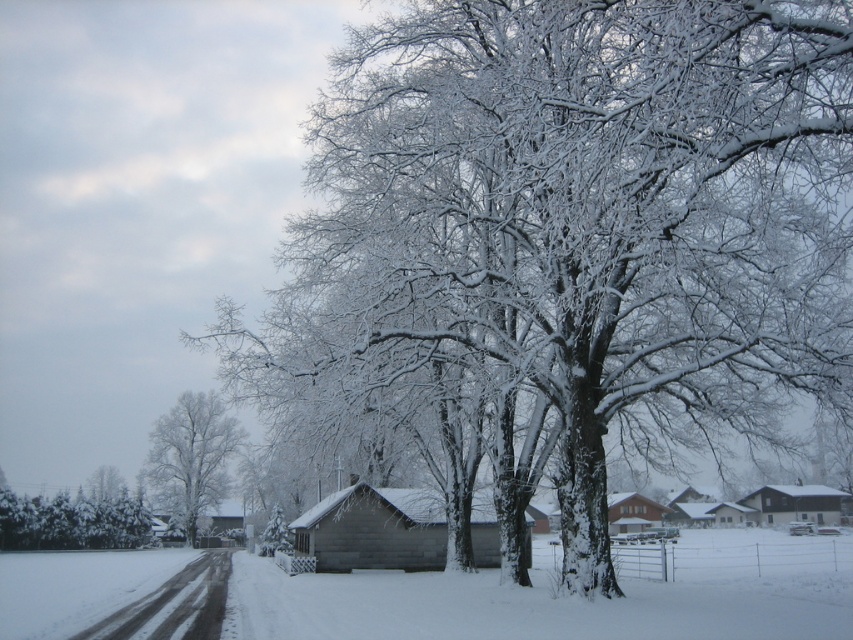
Can you confirm if white frosty tree at center is shorter than brown wooden house at center-right?

In fact, white frosty tree at center may be taller than brown wooden house at center-right.

From the picture: Which is below, white frosty tree at center or brown wooden house at center-right?

brown wooden house at center-right is below.

The image size is (853, 640). What do you see at coordinates (190, 456) in the screenshot?
I see `white frosty tree at center` at bounding box center [190, 456].

The height and width of the screenshot is (640, 853). Identify the location of white frosty tree at center. (190, 456).

How distant is wooden barn at center from wooden cabin at center?

wooden barn at center and wooden cabin at center are 21.54 meters apart from each other.

Which is more to the right, wooden barn at center or wooden cabin at center?

Positioned to the right is wooden cabin at center.

Between point (389, 492) and point (688, 508), which one is positioned in front?

Point (389, 492) is in front.

What are the coordinates of `wooden barn at center` in the screenshot? It's located at (373, 529).

Between wooden barn at center and white frosty tree at center, which one is positioned higher?

wooden barn at center

Between point (480, 524) and point (190, 419), which one is positioned behind?

The point (190, 419) is more distant.

This screenshot has width=853, height=640. Find the location of `wooden barn at center`. wooden barn at center is located at coordinates (373, 529).